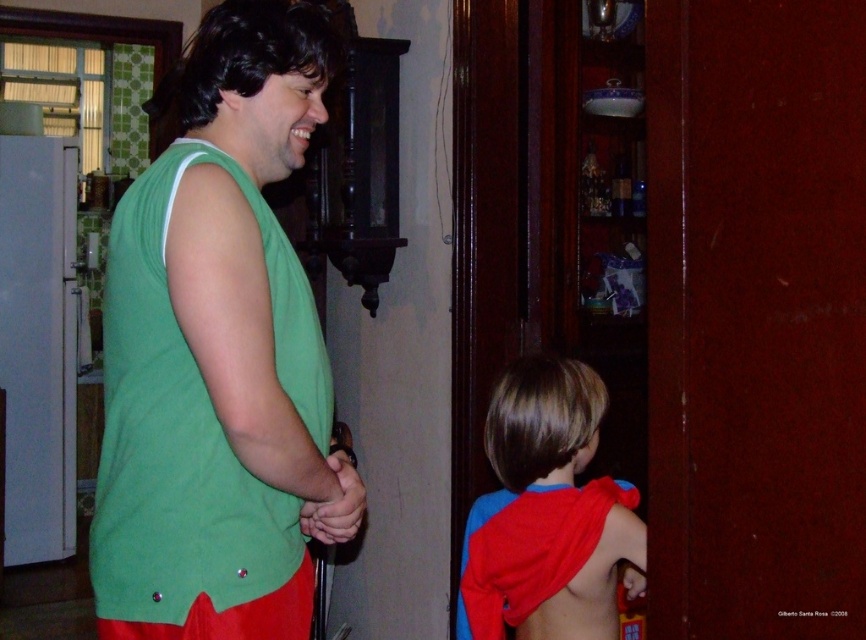
Question: Does green fabric shirt at center have a larger size compared to red fabric cape at lower right?

Choices:
 (A) yes
 (B) no

Answer: (A)

Question: Which point is farther from the camera taking this photo?

Choices:
 (A) (208, 176)
 (B) (530, 496)

Answer: (B)

Question: Is green fabric shirt at center closer to camera compared to red fabric cape at lower right?

Choices:
 (A) yes
 (B) no

Answer: (A)

Question: Which of the following is the closest to the observer?

Choices:
 (A) (483, 584)
 (B) (227, 392)

Answer: (B)

Question: Does green fabric shirt at center appear under red fabric cape at lower right?

Choices:
 (A) no
 (B) yes

Answer: (A)

Question: Which point is farther to the camera?

Choices:
 (A) (189, 376)
 (B) (527, 560)

Answer: (B)